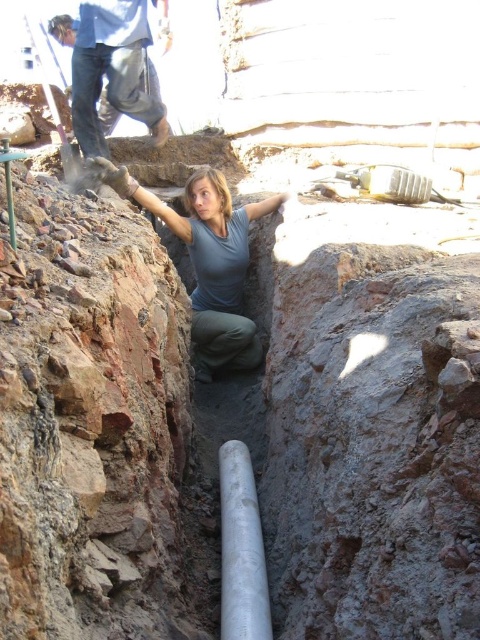
Who is more distant from viewer, (214, 282) or (87, 129)?

Point (87, 129)

Is point (146, 198) positioned before point (103, 154)?

Yes, point (146, 198) is in front of point (103, 154).

At what (x,y) coordinates should I click in order to perform the action: click on matte gray shirt at center. Please return your answer as a coordinate pair (x, y). The image size is (480, 640). Looking at the image, I should click on (207, 260).

What are the coordinates of `matte gray shirt at center` in the screenshot? It's located at (207, 260).

Between point (245, 346) and point (231, 506), which one is positioned behind?

Positioned behind is point (245, 346).

Which of these two, matte gray shirt at center or silver metallic pipe at center, stands taller?

With more height is silver metallic pipe at center.

Locate an element on the screen. This screenshot has height=640, width=480. matte gray shirt at center is located at coordinates point(207,260).

Between point (94, 3) and point (243, 596), which one is positioned in front?

Point (243, 596) is more forward.

Is point (116, 116) positioned after point (240, 492)?

Yes, it is.

The height and width of the screenshot is (640, 480). What do you see at coordinates (108, 68) in the screenshot?
I see `blue jeans at upper left` at bounding box center [108, 68].

Identify the location of blue jeans at upper left. (108, 68).